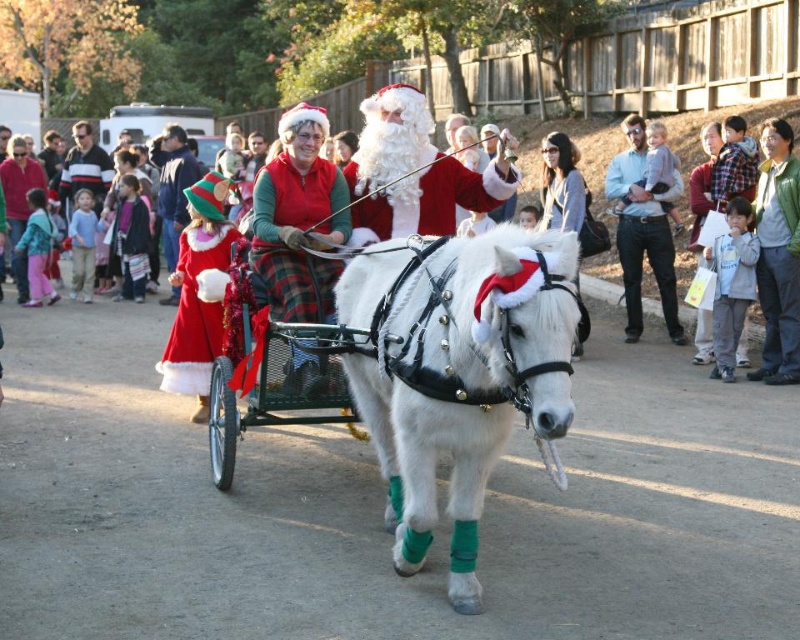
Is white fluffy santa at center wider than white fluffy beard at center?

No.

Between point (312, 218) and point (397, 221), which one is positioned in front?

Point (397, 221) is more forward.

What are the coordinates of `white fluffy santa at center` in the screenshot? It's located at (300, 220).

Consider the image. Between gray fleece jacket at lower right and striped sweater at center, which one has less height?

With less height is striped sweater at center.

Between point (716, 340) and point (74, 179), which one is positioned in front?

Positioned in front is point (716, 340).

This screenshot has height=640, width=800. In order to click on gray fleece jacket at lower right in this screenshot , I will do `click(732, 284)`.

Does matte red coat at upper center have a lesser height compared to gray fleece jacket at lower right?

In fact, matte red coat at upper center may be taller than gray fleece jacket at lower right.

The height and width of the screenshot is (640, 800). Identify the location of matte red coat at upper center. (580, 168).